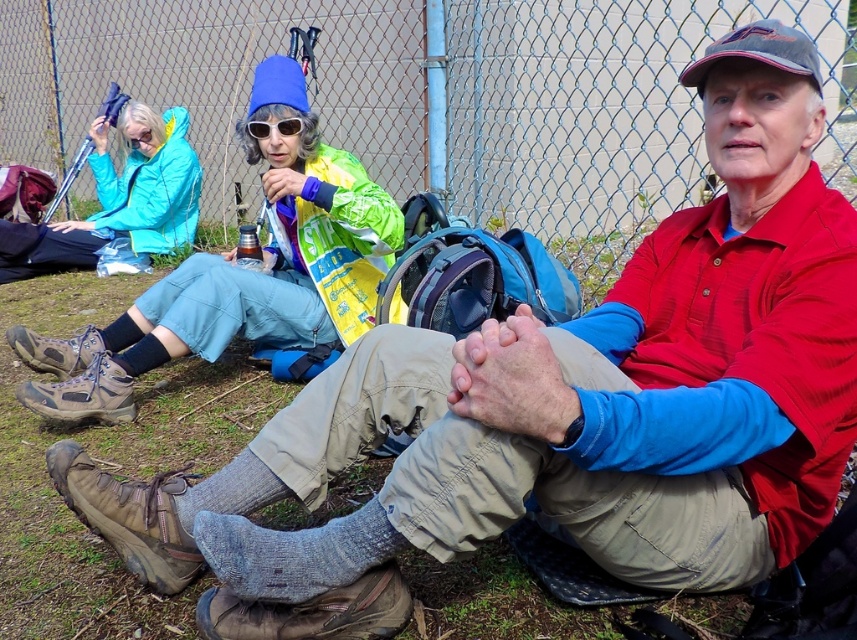
Question: Is metal chain-link fence at upper center in front of sunglasses at center?

Choices:
 (A) yes
 (B) no

Answer: (B)

Question: Considering the real-world distances, which object is closest to the metal chain-link fence at upper center?

Choices:
 (A) matte blue jacket at left
 (B) sunglasses at center

Answer: (B)

Question: Among these points, which one is nearest to the camera?

Choices:
 (A) (270, 179)
 (B) (214, 86)
 (C) (265, 125)

Answer: (A)

Question: Is metal chain-link fence at upper center further to camera compared to shiny blue beanie at upper left?

Choices:
 (A) yes
 (B) no

Answer: (A)

Question: Which of these objects is positioned closest to the sunglasses at center?

Choices:
 (A) matte blue jacket at left
 (B) shiny blue beanie at upper left
 (C) metal chain-link fence at upper center

Answer: (B)

Question: Is shiny blue beanie at upper left thinner than matte blue jacket at left?

Choices:
 (A) no
 (B) yes

Answer: (A)